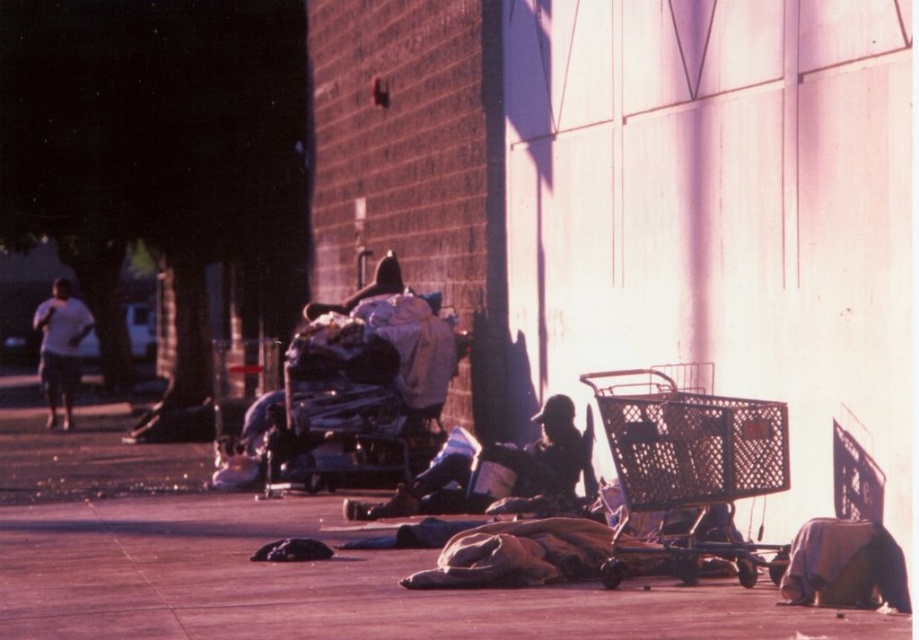
Question: Does dark skin person at center lie behind white cotton shirt at left?

Choices:
 (A) yes
 (B) no

Answer: (B)

Question: Which point is farther to the camera?

Choices:
 (A) (648, 451)
 (B) (744, 605)
 (C) (75, 348)
 (D) (590, 492)

Answer: (C)

Question: Does smooth concrete pavement at lower center appear under metallic silver shopping cart at lower right?

Choices:
 (A) yes
 (B) no

Answer: (A)

Question: Estimate the real-world distances between objects in this image. Which object is farther from the smooth concrete pavement at lower center?

Choices:
 (A) metallic silver shopping cart at lower right
 (B) white cotton shirt at left
 (C) dark skin person at center

Answer: (B)

Question: Is dark skin person at center positioned behind white cotton shirt at left?

Choices:
 (A) no
 (B) yes

Answer: (A)

Question: Which is nearer to the dark skin person at center?

Choices:
 (A) metallic silver shopping cart at lower right
 (B) white cotton shirt at left
 (C) smooth concrete pavement at lower center

Answer: (A)